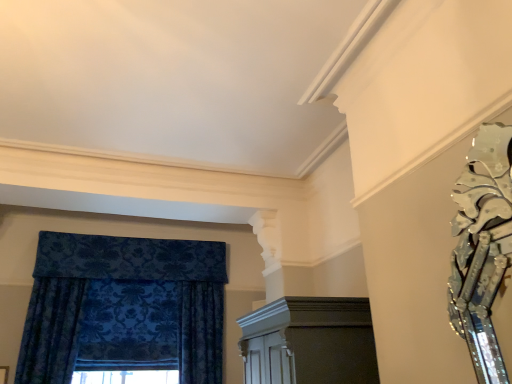
Question: Should I look upward or downward to see silver metallic sculpture at upper right?

Choices:
 (A) up
 (B) down

Answer: (B)